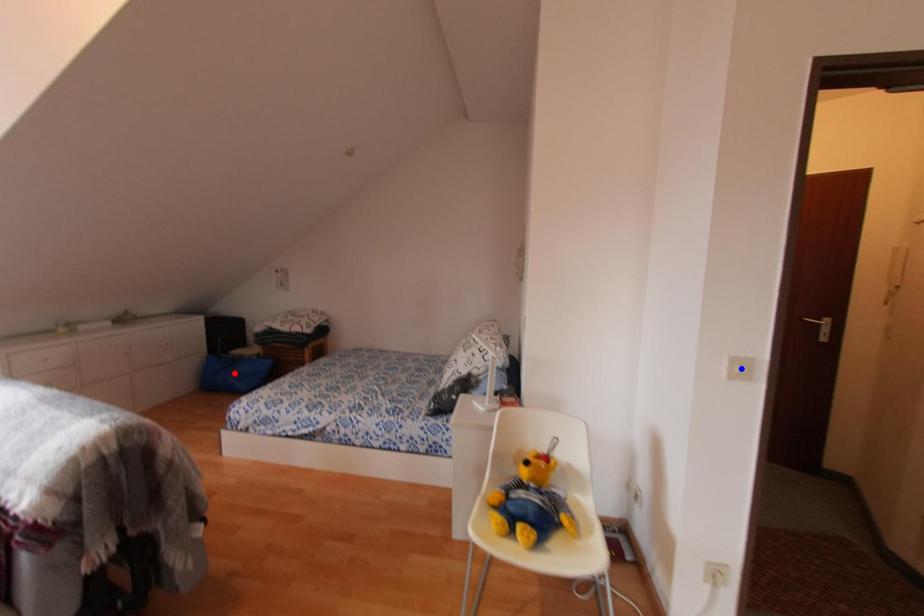
Question: In the image, two points are highlighted. Which point is nearer to the camera? Reply with the corresponding letter.

Choices:
 (A) blue point
 (B) red point

Answer: (A)